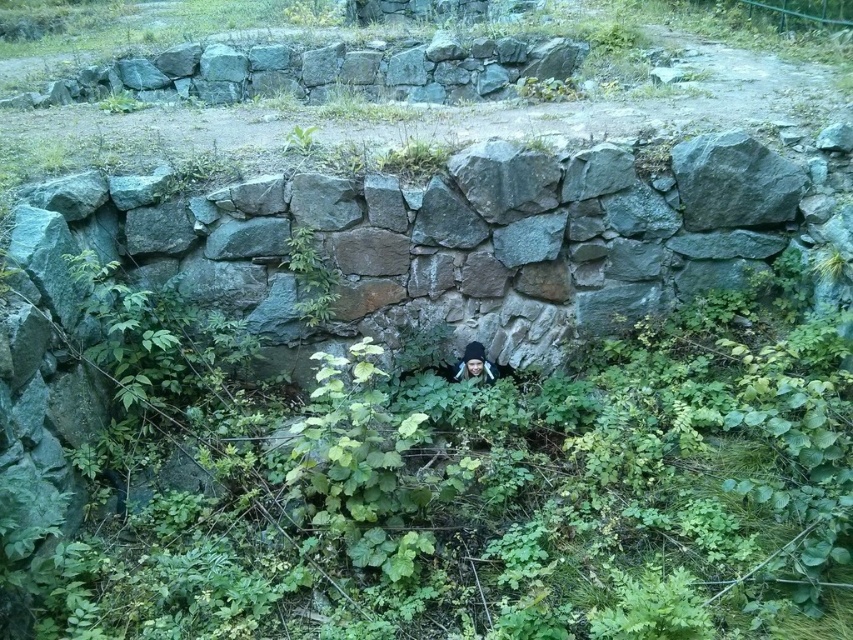
Question: Which of these objects is positioned farthest from the gray rough stone wall at upper center?

Choices:
 (A) green leafy plant at center
 (B) black knit cap at center

Answer: (B)

Question: Can you confirm if gray rough stone wall at upper center is positioned to the right of green leafy plant at center?

Choices:
 (A) no
 (B) yes

Answer: (A)

Question: Based on their relative distances, which object is farther from the black knit cap at center?

Choices:
 (A) gray rough stone wall at upper center
 (B) green leafy plant at center

Answer: (A)

Question: Is gray rough stone wall at upper center below black knit cap at center?

Choices:
 (A) yes
 (B) no

Answer: (B)

Question: Among these objects, which one is farthest from the camera?

Choices:
 (A) gray rough stone wall at upper center
 (B) black knit cap at center

Answer: (A)

Question: Does gray rough stone wall at upper center have a lesser width compared to green leafy plant at center?

Choices:
 (A) no
 (B) yes

Answer: (A)